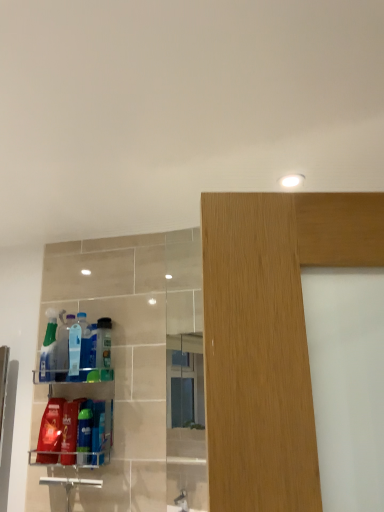
Question: Is translucent plastic spray bottle at left, the 1th cleaning product viewed from the left, located outside matte red plastic bottle at lower left, acting as the 7th cleaning product starting from the right?

Choices:
 (A) yes
 (B) no

Answer: (A)

Question: Is translucent plastic spray bottle at left, the 1th cleaning product viewed from the left, wider than matte red plastic bottle at lower left, acting as the 7th cleaning product starting from the right?

Choices:
 (A) no
 (B) yes

Answer: (B)

Question: From a real-world perspective, is translucent plastic spray bottle at left, marked as the eighth cleaning product in a right-to-left arrangement, positioned over matte red plastic bottle at lower left, acting as the 7th cleaning product starting from the right, based on gravity?

Choices:
 (A) no
 (B) yes

Answer: (B)

Question: From the image's perspective, is translucent plastic spray bottle at left, the 1th cleaning product viewed from the left, beneath matte red plastic bottle at lower left, acting as the second cleaning product starting from the left?

Choices:
 (A) no
 (B) yes

Answer: (A)

Question: Are translucent plastic spray bottle at left, marked as the eighth cleaning product in a right-to-left arrangement, and matte red plastic bottle at lower left, acting as the 7th cleaning product starting from the right, beside each other?

Choices:
 (A) no
 (B) yes

Answer: (A)

Question: Would you say translucent plastic bottles at left, arranged as the 5th cleaning product when viewed from the right, is inside or outside translucent plastic bottle at left, the 6th cleaning product from the right?

Choices:
 (A) outside
 (B) inside

Answer: (A)

Question: Is translucent plastic bottles at left, marked as the 4th cleaning product in a left-to-right arrangement, to the left or to the right of translucent plastic bottle at left, the 3th cleaning product when ordered from left to right, in the image?

Choices:
 (A) right
 (B) left

Answer: (A)

Question: Is point (74, 352) closer or farther from the camera than point (64, 324)?

Choices:
 (A) closer
 (B) farther

Answer: (A)

Question: Relative to translucent plastic bottle at left, the 3th cleaning product when ordered from left to right, is translucent plastic bottles at left, arranged as the 5th cleaning product when viewed from the right, in front or behind?

Choices:
 (A) behind
 (B) front

Answer: (B)

Question: From their relative heights in the image, would you say translucent plastic bottle at center, the 8th cleaning product when ordered from left to right, is taller or shorter than blue glossy bottle at lower left, the 6th cleaning product in the left-to-right sequence?

Choices:
 (A) tall
 (B) short

Answer: (A)

Question: Based on their sizes in the image, would you say translucent plastic bottle at center, the 8th cleaning product when ordered from left to right, is bigger or smaller than blue glossy bottle at lower left, the 6th cleaning product in the left-to-right sequence?

Choices:
 (A) small
 (B) big

Answer: (B)

Question: From the image's perspective, is translucent plastic bottle at center, acting as the 1th cleaning product starting from the right, above or below blue glossy bottle at lower left, the 6th cleaning product in the left-to-right sequence?

Choices:
 (A) above
 (B) below

Answer: (A)

Question: Is translucent plastic bottle at center, acting as the 1th cleaning product starting from the right, situated inside blue glossy bottle at lower left, the 6th cleaning product in the left-to-right sequence, or outside?

Choices:
 (A) outside
 (B) inside

Answer: (A)

Question: Is matte red plastic bottle at lower left, acting as the second cleaning product starting from the left, wider or thinner than translucent plastic bottles at left, marked as the 4th cleaning product in a left-to-right arrangement?

Choices:
 (A) thin
 (B) wide

Answer: (B)

Question: From the image's perspective, relative to translucent plastic bottles at left, arranged as the 5th cleaning product when viewed from the right, is matte red plastic bottle at lower left, acting as the 7th cleaning product starting from the right, above or below?

Choices:
 (A) above
 (B) below

Answer: (B)